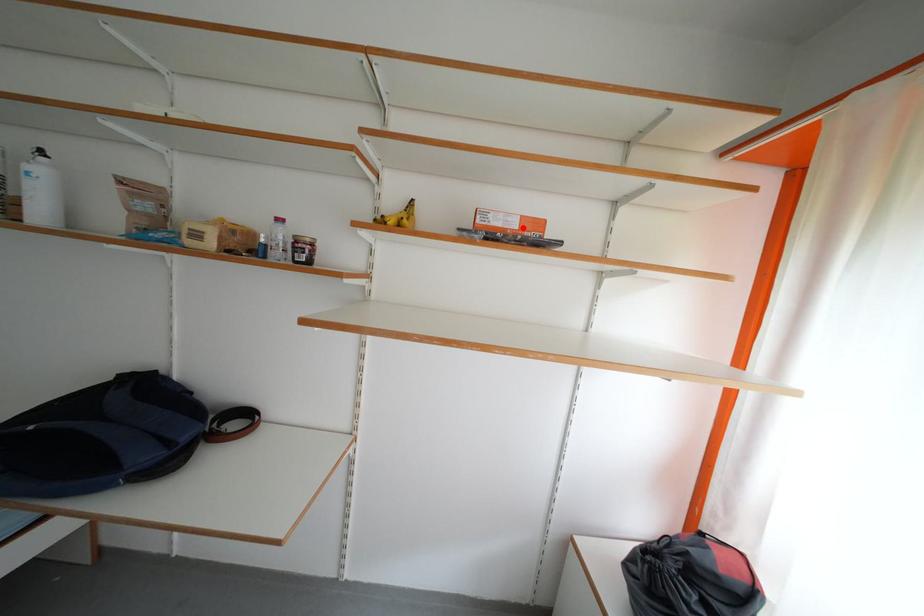
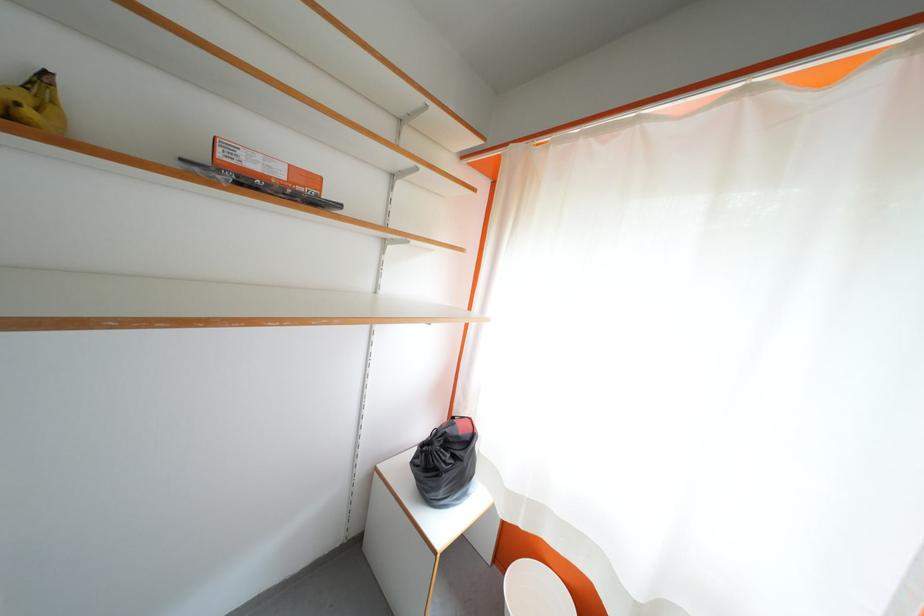
In the second image, find the point that corresponds to the highlighted location in the first image.

(289, 177)